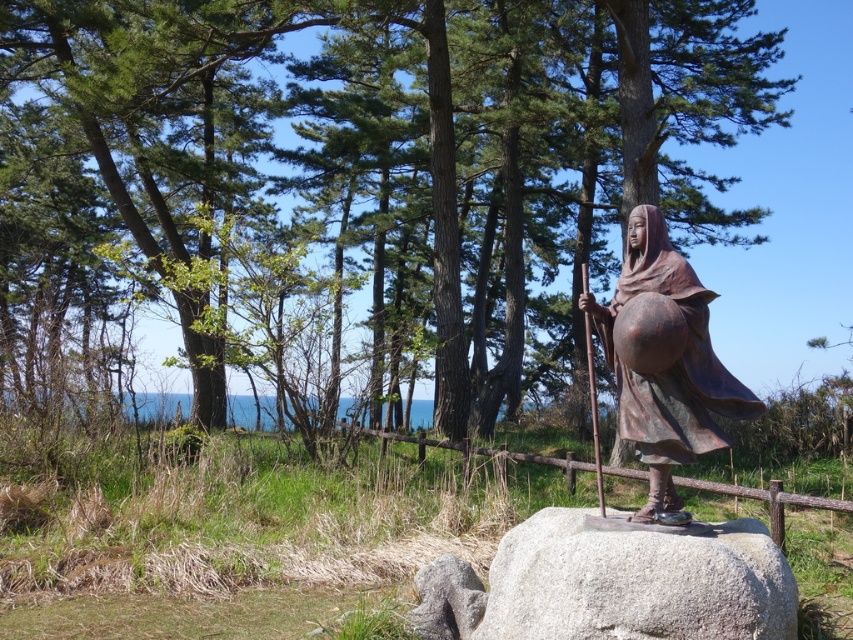
Question: Is gray granite boulder at center smaller than brown wooden rail at center?

Choices:
 (A) no
 (B) yes

Answer: (B)

Question: Considering the real-world distances, which object is farthest from the green leafy tree at center?

Choices:
 (A) gray granite boulder at center
 (B) bronze statue at center

Answer: (B)

Question: Which of the following is the farthest from the observer?

Choices:
 (A) (730, 392)
 (B) (683, 483)

Answer: (B)

Question: Can you confirm if bronze statue at center is thinner than brown wooden rail at center?

Choices:
 (A) yes
 (B) no

Answer: (A)

Question: Which point is farther to the camera?

Choices:
 (A) brown wooden rail at center
 (B) green leafy tree at center
 (C) bronze statue at center

Answer: (B)

Question: Is green leafy tree at center to the left of bronze metallic pole at center from the viewer's perspective?

Choices:
 (A) no
 (B) yes

Answer: (B)